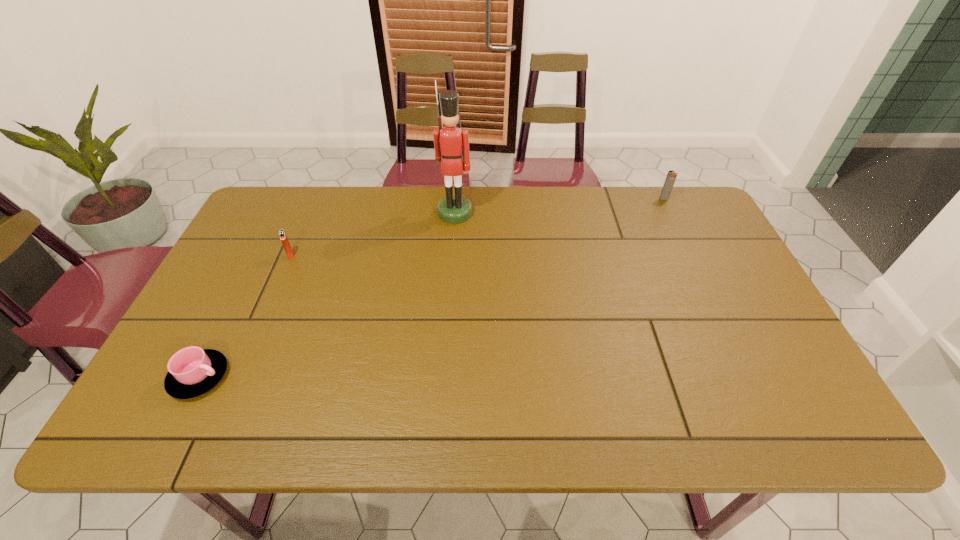
Image resolution: width=960 pixels, height=540 pixels. I want to click on vacant point at the near edge, so click(x=517, y=413).

Where is `free location at the right edge of the desktop`? free location at the right edge of the desktop is located at coordinates (693, 235).

Identify the location of vacant space at the near left corner of the desktop. The image size is (960, 540). (159, 410).

The width and height of the screenshot is (960, 540). I want to click on free space between the shortest object and the third object from left to right, so click(x=327, y=295).

Where is `free space between the left igniter and the right igniter`? free space between the left igniter and the right igniter is located at coordinates (477, 227).

At what (x,y) coordinates should I click in order to perform the action: click on free space that is in between the third object from left to right and the rightmost object. Please return your answer as a coordinate pair (x, y). This screenshot has height=540, width=960. Looking at the image, I should click on (560, 206).

Locate an element on the screen. This screenshot has width=960, height=540. vacant area between the second object from left to right and the cup is located at coordinates (245, 316).

The width and height of the screenshot is (960, 540). Find the location of `empty location between the third object from right to left and the nearest object`. empty location between the third object from right to left and the nearest object is located at coordinates (245, 316).

In order to click on free space between the cup and the second farthest object in this screenshot , I will do `click(327, 295)`.

Where is `free area in between the farther igniter and the second shortest object`? This screenshot has width=960, height=540. free area in between the farther igniter and the second shortest object is located at coordinates (477, 227).